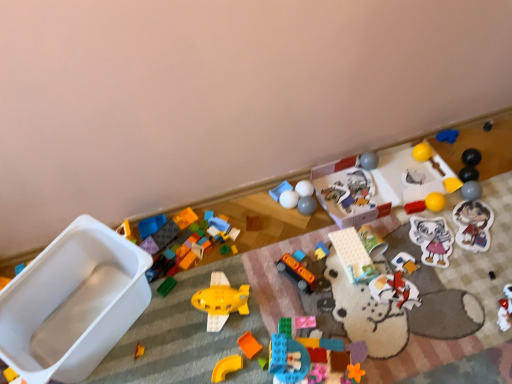
The height and width of the screenshot is (384, 512). I want to click on spots to the right of orange matte bus at center, the tenth toy when ordered from left to right, so click(344, 284).